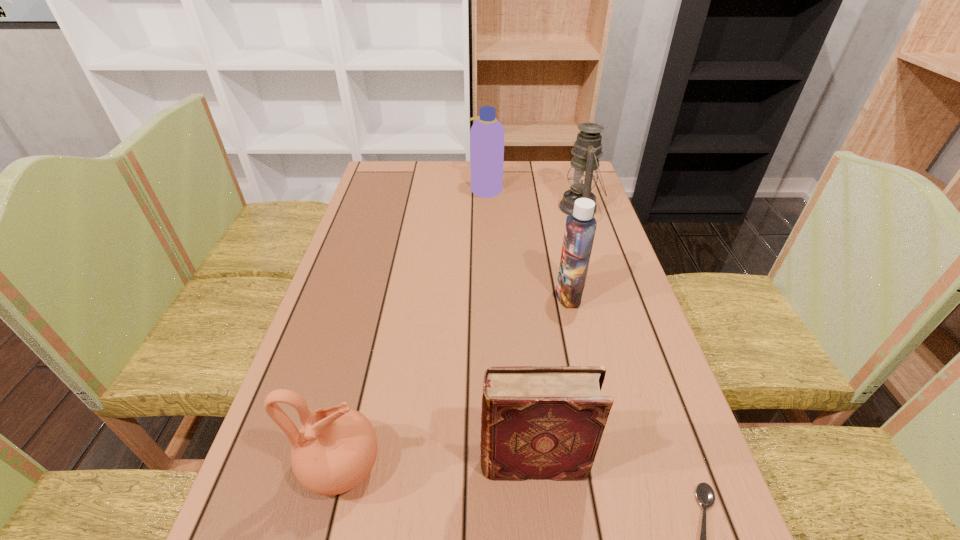
Find the location of a particular element. vacant position located 0.140m on the front label of the right shampoo is located at coordinates (501, 295).

Locate an element on the screen. free spot located on the spine side of the hardback book is located at coordinates pyautogui.click(x=431, y=463).

The width and height of the screenshot is (960, 540). In order to click on free space located 0.160m on the spine side of the hardback book in this screenshot , I will do `click(392, 463)`.

Identify the location of free space located on the spine side of the hardback book. (276, 463).

Where is `vacant space located on the spout of the leftmost object`? vacant space located on the spout of the leftmost object is located at coordinates (553, 467).

In order to click on shampoo at the far edge in this screenshot , I will do `click(487, 134)`.

Find the location of a particular element. This screenshot has height=540, width=960. oil lamp that is positioned at the far edge is located at coordinates (583, 173).

At what (x,y) coordinates should I click in order to perform the action: click on object that is positioned at the left edge. Please return your answer as a coordinate pair (x, y). This screenshot has width=960, height=540. Looking at the image, I should click on (335, 449).

Image resolution: width=960 pixels, height=540 pixels. I want to click on oil lamp located in the right edge section of the desktop, so click(x=583, y=173).

Locate an element on the screen. shampoo that is at the right edge is located at coordinates click(x=580, y=227).